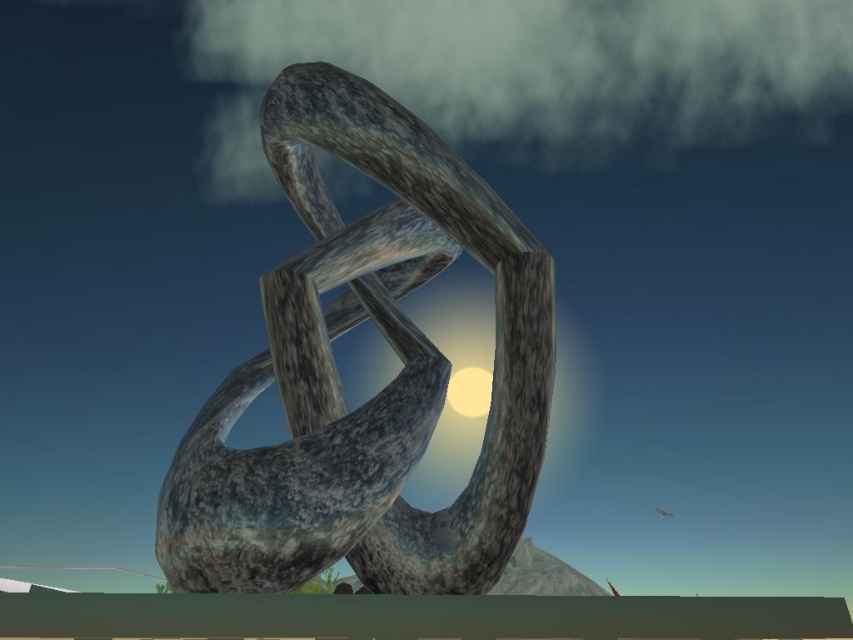
Question: Does rustic stone sculpture at center have a larger size compared to matte gray sphere at center?

Choices:
 (A) no
 (B) yes

Answer: (B)

Question: Is rustic stone sculpture at center smaller than matte gray sphere at center?

Choices:
 (A) yes
 (B) no

Answer: (B)

Question: Which point is farther from the camera taking this photo?

Choices:
 (A) (489, 385)
 (B) (335, 326)

Answer: (B)

Question: Which object is farther from the camera taking this photo?

Choices:
 (A) matte gray sphere at center
 (B) rustic stone sculpture at center

Answer: (A)

Question: Can you confirm if rustic stone sculpture at center is positioned above matte gray sphere at center?

Choices:
 (A) yes
 (B) no

Answer: (A)

Question: Which point is closer to the camera?

Choices:
 (A) matte gray sphere at center
 (B) rustic stone sculpture at center

Answer: (B)